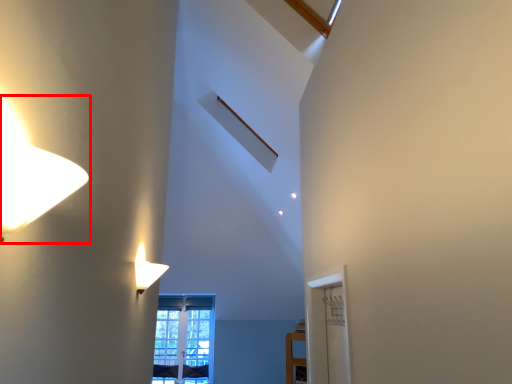
Question: In this image, where is lamp (annotated by the red box) located relative to window?

Choices:
 (A) right
 (B) left

Answer: (A)